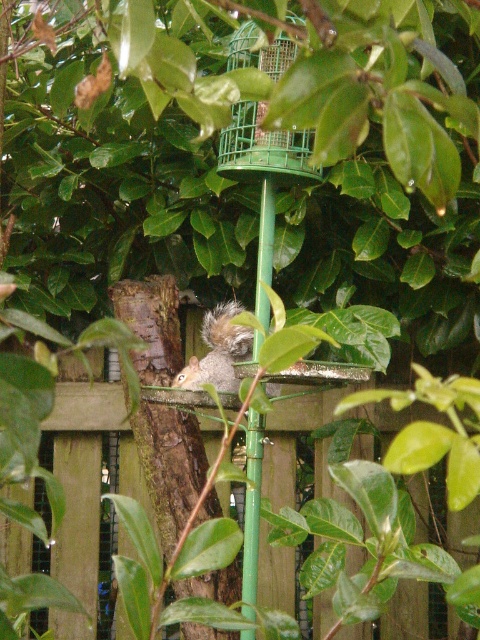
Question: Which point is farther from the camera taking this photo?

Choices:
 (A) (84, 396)
 (B) (251, 132)

Answer: (A)

Question: Can you confirm if wooden fence at center is positioned below green wire mesh bird feeder at center?

Choices:
 (A) yes
 (B) no

Answer: (A)

Question: Among these objects, which one is farthest from the camera?

Choices:
 (A) wooden fence at center
 (B) brown rough tree trunk at center
 (C) green wire mesh bird feeder at center
 (D) gray furry squirrel at center

Answer: (A)

Question: Does green wire mesh bird feeder at center appear under gray furry squirrel at center?

Choices:
 (A) yes
 (B) no

Answer: (B)

Question: Is wooden fence at center to the right of green wire mesh bird feeder at center from the viewer's perspective?

Choices:
 (A) yes
 (B) no

Answer: (B)

Question: Which object is farther from the camera taking this photo?

Choices:
 (A) green wire mesh bird feeder at center
 (B) brown rough tree trunk at center

Answer: (B)